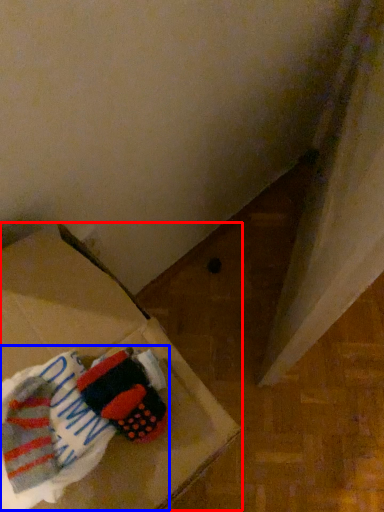
Question: Which object appears closest to the camera in this image, cardboard box (highlighted by a red box) or laundry (highlighted by a blue box)?

Choices:
 (A) cardboard box
 (B) laundry

Answer: (A)